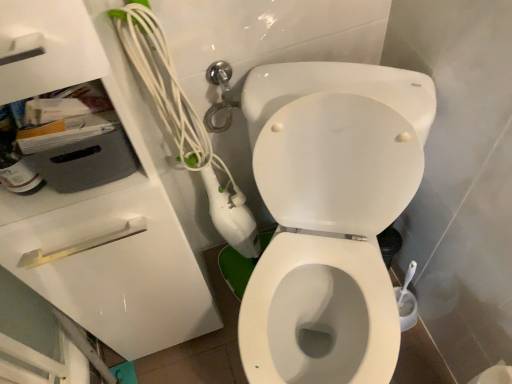
Question: Considering the positions of white glossy toilet at center and yellow plastic drawer at upper left in the image, is white glossy toilet at center wider or thinner than yellow plastic drawer at upper left?

Choices:
 (A) wide
 (B) thin

Answer: (A)

Question: Is point (324, 144) closer or farther from the camera than point (130, 256)?

Choices:
 (A) farther
 (B) closer

Answer: (A)

Question: Is white glossy toilet at center bigger or smaller than yellow plastic drawer at upper left?

Choices:
 (A) small
 (B) big

Answer: (B)

Question: Considering the relative positions of yellow plastic drawer at upper left and white glossy toilet at center in the image provided, is yellow plastic drawer at upper left to the left or to the right of white glossy toilet at center?

Choices:
 (A) right
 (B) left

Answer: (B)

Question: Looking at the image, does yellow plastic drawer at upper left seem bigger or smaller compared to white glossy toilet at center?

Choices:
 (A) big
 (B) small

Answer: (B)

Question: In terms of width, does yellow plastic drawer at upper left look wider or thinner when compared to white glossy toilet at center?

Choices:
 (A) thin
 (B) wide

Answer: (A)

Question: Does point (101, 326) appear closer or farther from the camera than point (294, 193)?

Choices:
 (A) closer
 (B) farther

Answer: (B)